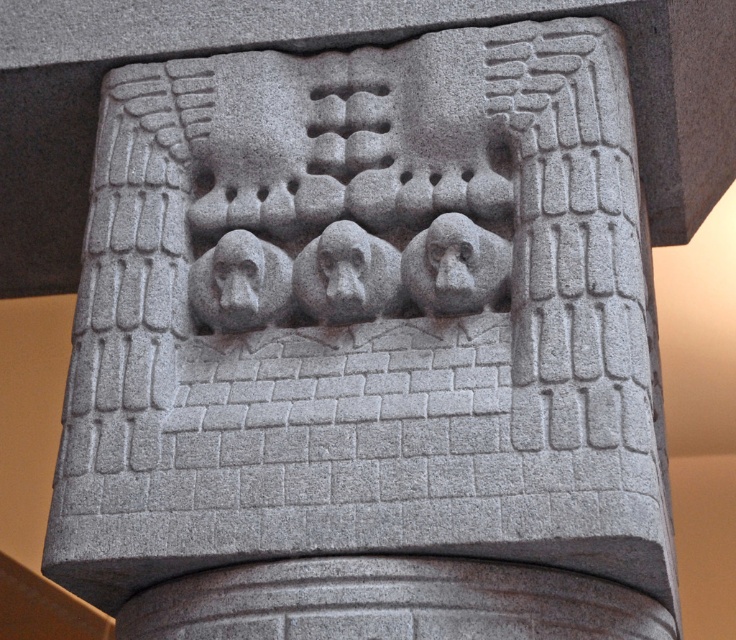
Looking at this image, is gray stone monkeys at center to the left of granite monkey at center from the viewer's perspective?

Indeed, gray stone monkeys at center is positioned on the left side of granite monkey at center.

Is gray stone monkeys at center smaller than granite monkey at center?

Indeed, gray stone monkeys at center has a smaller size compared to granite monkey at center.

Which is in front, point (328, 256) or point (435, 305)?

Point (435, 305) is in front.

Where is `gray stone monkeys at center`? The image size is (736, 640). gray stone monkeys at center is located at coordinates (346, 275).

Does granite monkey at center appear on the right side of gray stone monkey at center?

Correct, you'll find granite monkey at center to the right of gray stone monkey at center.

Is granite monkey at center to the left of gray stone monkey at center from the viewer's perspective?

Incorrect, granite monkey at center is not on the left side of gray stone monkey at center.

Does point (450, 312) come closer to viewer compared to point (222, 317)?

Yes, it is.

Locate an element on the screen. The height and width of the screenshot is (640, 736). granite monkey at center is located at coordinates (456, 266).

Can you confirm if gray stone monkeys at center is bigger than gray stone monkey at center?

No.

Which is more to the right, gray stone monkeys at center or gray stone monkey at center?

gray stone monkeys at center

In order to click on gray stone monkeys at center in this screenshot , I will do `click(346, 275)`.